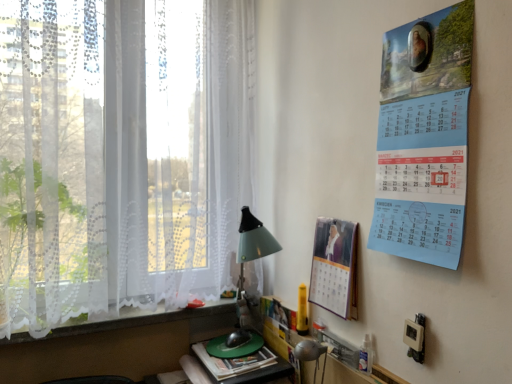
The height and width of the screenshot is (384, 512). What do you see at coordinates (143, 320) in the screenshot?
I see `white lace at lower left` at bounding box center [143, 320].

Locate an element on the screen. This screenshot has height=384, width=512. matte paper calendar at right, marked as the 2th poster page in a top-to-bottom arrangement is located at coordinates 335,267.

The width and height of the screenshot is (512, 384). Describe the element at coordinates (335, 267) in the screenshot. I see `matte paper calendar at right, marked as the first poster page in a bottom-to-top arrangement` at that location.

I want to click on blue paper calendar at upper right, which is the 1th poster page in front-to-back order, so click(424, 137).

What is the approximate height of white lace curtain at left?

1.25 meters.

Locate an element on the screen. green plastic computer mouse at lower center is located at coordinates (253, 370).

Can you see white lace at lower left touching white lace curtain at left?

No, white lace at lower left is not in contact with white lace curtain at left.

From a real-world perspective, is white lace at lower left physically below white lace curtain at left?

Yes, from a real-world perspective, white lace at lower left is beneath white lace curtain at left.

Based on the photo, considering the positions of objects white lace at lower left and white lace curtain at left in the image provided, who is behind, white lace at lower left or white lace curtain at left?

white lace at lower left is more distant.

Would you say white lace at lower left is to the left or to the right of white lace curtain at left in the picture?

Clearly, white lace at lower left is on the left of white lace curtain at left in the image.

Is white lace curtain at left not inside matte green table lamp at lower center?

Indeed, white lace curtain at left is completely outside matte green table lamp at lower center.

Considering the relative sizes of white lace curtain at left and matte green table lamp at lower center in the image provided, is white lace curtain at left bigger than matte green table lamp at lower center?

Indeed, white lace curtain at left has a larger size compared to matte green table lamp at lower center.

Is white lace curtain at left touching matte green table lamp at lower center?

No, white lace curtain at left is not with matte green table lamp at lower center.

Looking at this image, from a real-world perspective, between white lace curtain at left and matte green table lamp at lower center, who is vertically lower?

matte green table lamp at lower center is physically lower.

Where is `window on the right of white lace at lower left`? This screenshot has width=512, height=384. window on the right of white lace at lower left is located at coordinates (121, 155).

Considering the sizes of objects white lace curtain at left and white lace at lower left in the image provided, who is shorter, white lace curtain at left or white lace at lower left?

white lace at lower left is shorter.

Is white lace curtain at left positioned beyond the bounds of white lace at lower left?

Yes, white lace curtain at left is located beyond the bounds of white lace at lower left.

From a real-world perspective, who is located lower, white lace at lower left or green plastic computer mouse at lower center?

green plastic computer mouse at lower center, from a real-world perspective.

Looking at this image, is the surface of white lace at lower left in direct contact with green plastic computer mouse at lower center?

No, white lace at lower left is not next to green plastic computer mouse at lower center.

Which is correct: white lace at lower left is inside green plastic computer mouse at lower center, or outside of it?

white lace at lower left is not inside green plastic computer mouse at lower center, it's outside.

Measure the distance from white lace at lower left to green plastic computer mouse at lower center.

A distance of 11.24 inches exists between white lace at lower left and green plastic computer mouse at lower center.

Consider the image. Is the depth of white lace curtain at left greater than that of green plastic computer mouse at lower center?

No, it is not.

Measure the distance between white lace curtain at left and green plastic computer mouse at lower center.

28.94 inches.

Which object is thinner, white lace curtain at left or green plastic computer mouse at lower center?

white lace curtain at left.

From the image's perspective, is white lace curtain at left above or below green plastic computer mouse at lower center?

Clearly, from the image's perspective, white lace curtain at left is above green plastic computer mouse at lower center.

Where is `window on the left of matte paper calendar at right, marked as the first poster page in a bottom-to-top arrangement`? The height and width of the screenshot is (384, 512). window on the left of matte paper calendar at right, marked as the first poster page in a bottom-to-top arrangement is located at coordinates (121, 155).

From a real-world perspective, is white lace curtain at left below matte paper calendar at right, which is the first poster page from back to front?

Incorrect, from a real-world perspective, white lace curtain at left is higher than matte paper calendar at right, which is the first poster page from back to front.

Is point (29, 103) farther from camera compared to point (321, 273)?

No, (29, 103) is in front of (321, 273).

From the picture: Is white lace curtain at left closer to camera compared to matte paper calendar at right, arranged as the 1th poster page when viewed from the left?

Yes, the depth of white lace curtain at left is less than that of matte paper calendar at right, arranged as the 1th poster page when viewed from the left.

From the image's perspective, does matte paper calendar at right, arranged as the 1th poster page when viewed from the left, appear lower than white lace curtain at left?

Yes, from the image's perspective, matte paper calendar at right, arranged as the 1th poster page when viewed from the left, is below white lace curtain at left.

Can we say matte paper calendar at right, arranged as the 1th poster page when viewed from the left, lies outside white lace curtain at left?

Yes, matte paper calendar at right, arranged as the 1th poster page when viewed from the left, is not within white lace curtain at left.

In terms of height, does matte paper calendar at right, marked as the first poster page in a bottom-to-top arrangement, look taller or shorter compared to white lace curtain at left?

Considering their sizes, matte paper calendar at right, marked as the first poster page in a bottom-to-top arrangement, has less height than white lace curtain at left.

Where is `window that is above the white lace at lower left (from the image's perspective)`? The image size is (512, 384). window that is above the white lace at lower left (from the image's perspective) is located at coordinates (121, 155).

Locate an element on the screen. window that appears above the matte green table lamp at lower center (from a real-world perspective) is located at coordinates (121, 155).

When comparing their distances from green plastic computer mouse at lower center, does blue paper calendar at upper right, the second poster page from the back, or white lace at lower left seem closer?

white lace at lower left is closer to green plastic computer mouse at lower center.

Estimate the real-world distances between objects in this image. Which object is closer to blue paper calendar at upper right, the 1th poster page from the top, matte paper calendar at right, which is counted as the second poster page, starting from the front, or green plastic computer mouse at lower center?

Among the two, matte paper calendar at right, which is counted as the second poster page, starting from the front, is located nearer to blue paper calendar at upper right, the 1th poster page from the top.

Based on their spatial positions, is green plastic computer mouse at lower center or white lace curtain at left closer to matte paper calendar at right, arranged as the 1th poster page when viewed from the left?

green plastic computer mouse at lower center lies closer to matte paper calendar at right, arranged as the 1th poster page when viewed from the left, than the other object.

Looking at the image, which one is located further to white lace curtain at left, white lace at lower left or blue paper calendar at upper right, which is the 1th poster page in front-to-back order?

Based on the image, blue paper calendar at upper right, which is the 1th poster page in front-to-back order, appears to be further to white lace curtain at left.

Based on their spatial positions, is green plastic computer mouse at lower center or blue paper calendar at upper right, which is the 1th poster page in front-to-back order, closer to matte green table lamp at lower center?

green plastic computer mouse at lower center lies closer to matte green table lamp at lower center than the other object.

Looking at the image, which one is located further to blue paper calendar at upper right, the second poster page from the back, white lace at lower left or green plastic computer mouse at lower center?

The object further to blue paper calendar at upper right, the second poster page from the back, is white lace at lower left.

Based on the photo, considering their positions, is matte green table lamp at lower center positioned further to white lace at lower left than blue paper calendar at upper right, which is the 1th poster page in front-to-back order?

Among the two, blue paper calendar at upper right, which is the 1th poster page in front-to-back order, is located further to white lace at lower left.

When comparing their distances from matte green table lamp at lower center, does green plastic computer mouse at lower center or white lace at lower left seem closer?

Based on the image, green plastic computer mouse at lower center appears to be nearer to matte green table lamp at lower center.

In order to click on window sill between white lace curtain at left and matte green table lamp at lower center in the vertical direction in this screenshot , I will do `click(143, 320)`.

The height and width of the screenshot is (384, 512). What are the coordinates of `window located between white lace at lower left and blue paper calendar at upper right, positioned as the 2th poster page in left-to-right order, in the left-right direction` in the screenshot? It's located at (121, 155).

The height and width of the screenshot is (384, 512). I want to click on poster page situated between white lace at lower left and blue paper calendar at upper right, which is the 1th poster page in front-to-back order, from left to right, so click(x=335, y=267).

Find the location of a particular element. Image resolution: width=512 pixels, height=384 pixels. poster page between white lace curtain at left and blue paper calendar at upper right, positioned as the 2th poster page in left-to-right order, from left to right is located at coordinates (335, 267).